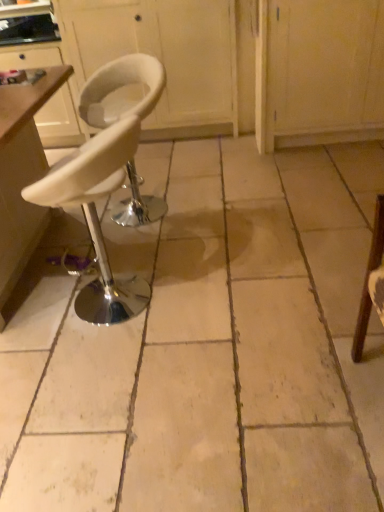
Where is `free space in front of white matte stool at center, which is the first chair from back to front`? Image resolution: width=384 pixels, height=512 pixels. free space in front of white matte stool at center, which is the first chair from back to front is located at coordinates (158, 243).